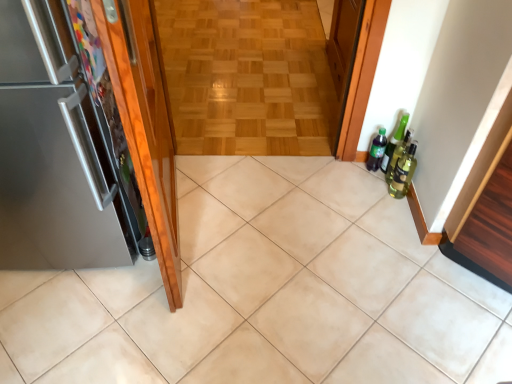
Identify the location of free space in front of green glass bottle at right, the 1th beer bottle viewed from the front. The height and width of the screenshot is (384, 512). (394, 219).